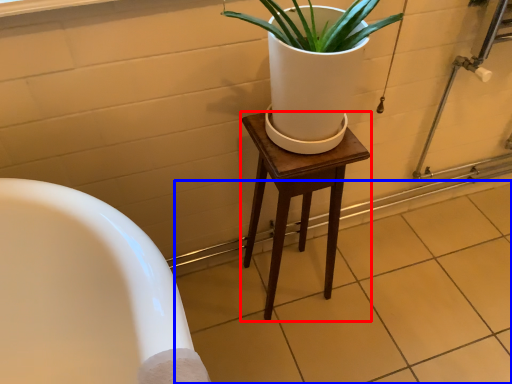
Question: Which object appears closest to the camera in this image, stool (highlighted by a red box) or tile (highlighted by a blue box)?

Choices:
 (A) stool
 (B) tile

Answer: (A)